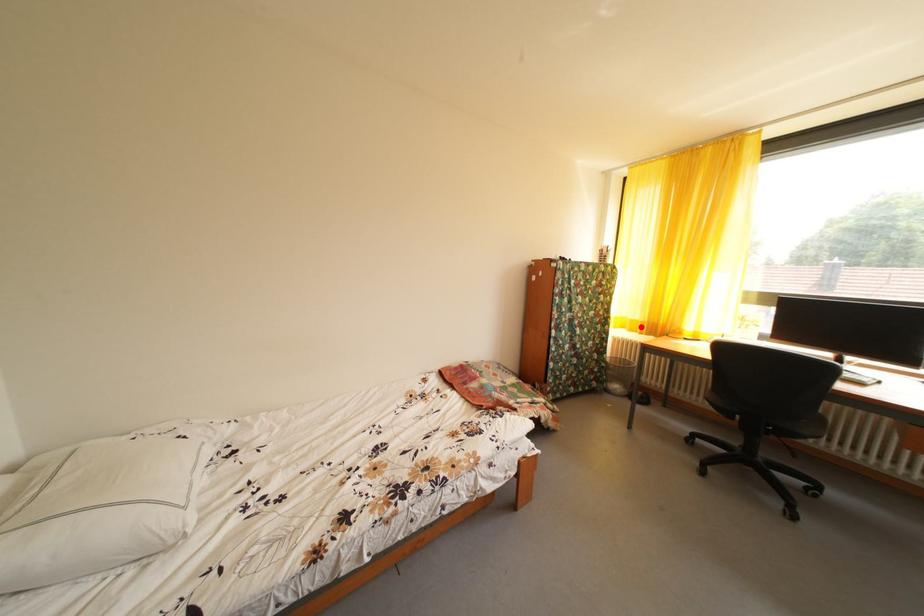
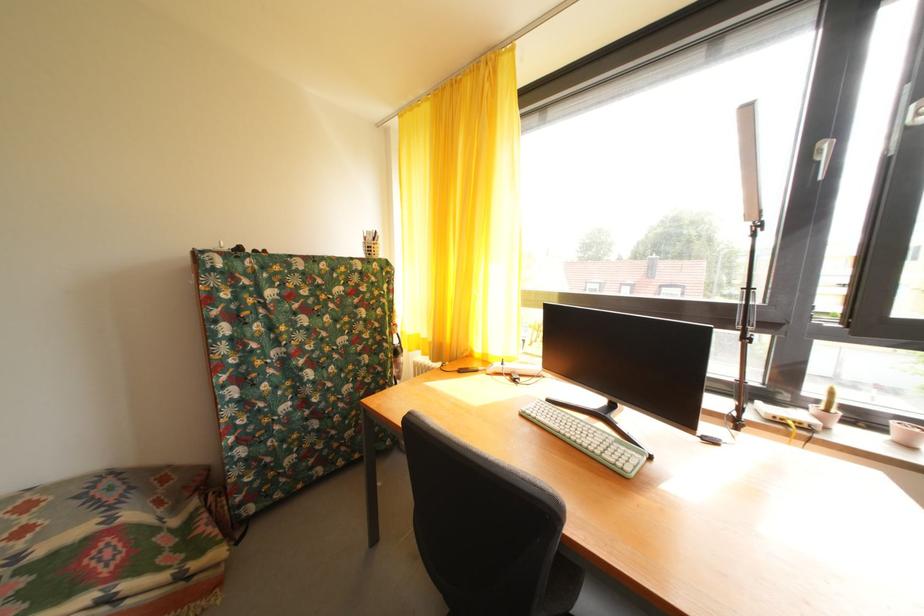
Locate, in the second image, the point that corresponds to the highlighted location in the first image.

(432, 346)